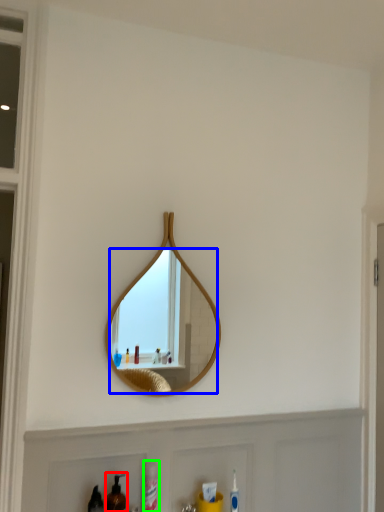
Question: Estimate the real-world distances between objects in this image. Which object is farther from mouthwash (highlighted by a red box), mirror (highlighted by a blue box) or cleaning product (highlighted by a green box)?

Choices:
 (A) mirror
 (B) cleaning product

Answer: (A)